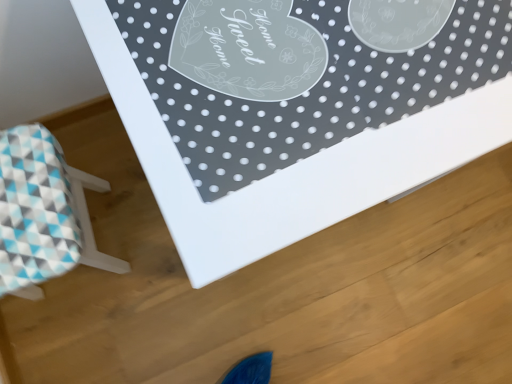
Locate an element on the screen. The image size is (512, 384). free location to the right of white glossy table at upper center is located at coordinates (434, 263).